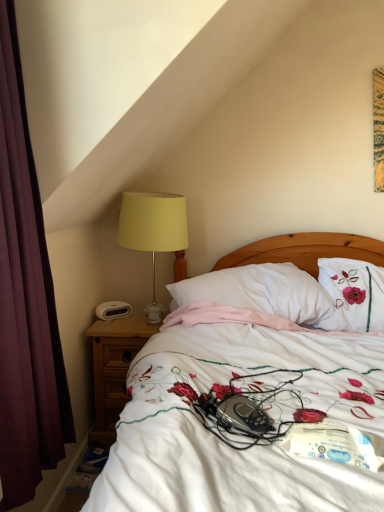
Question: Is the surface of maroon fabric curtain at left in direct contact with brown wooden nightstand at lower left?

Choices:
 (A) yes
 (B) no

Answer: (B)

Question: From the image's perspective, does maroon fabric curtain at left appear lower than brown wooden nightstand at lower left?

Choices:
 (A) yes
 (B) no

Answer: (B)

Question: Does maroon fabric curtain at left come behind brown wooden nightstand at lower left?

Choices:
 (A) no
 (B) yes

Answer: (A)

Question: Is maroon fabric curtain at left shorter than brown wooden nightstand at lower left?

Choices:
 (A) no
 (B) yes

Answer: (A)

Question: Is maroon fabric curtain at left turned away from brown wooden nightstand at lower left?

Choices:
 (A) no
 (B) yes

Answer: (A)

Question: Is maroon fabric curtain at left wider than brown wooden nightstand at lower left?

Choices:
 (A) no
 (B) yes

Answer: (A)

Question: Does brown wooden nightstand at lower left have a greater width compared to white plastic alarm clock at left?

Choices:
 (A) yes
 (B) no

Answer: (A)

Question: Can you confirm if brown wooden nightstand at lower left is shorter than white plastic alarm clock at left?

Choices:
 (A) no
 (B) yes

Answer: (A)

Question: Is brown wooden nightstand at lower left oriented towards white plastic alarm clock at left?

Choices:
 (A) yes
 (B) no

Answer: (B)

Question: Is brown wooden nightstand at lower left oriented away from white plastic alarm clock at left?

Choices:
 (A) yes
 (B) no

Answer: (B)

Question: Would you say brown wooden nightstand at lower left is a long distance from white plastic alarm clock at left?

Choices:
 (A) yes
 (B) no

Answer: (B)

Question: Would you say white plastic alarm clock at left is part of brown wooden nightstand at lower left's contents?

Choices:
 (A) yes
 (B) no

Answer: (B)

Question: Is white floral bedspread at center at the left side of yellow fabric lampshade at left?

Choices:
 (A) no
 (B) yes

Answer: (A)